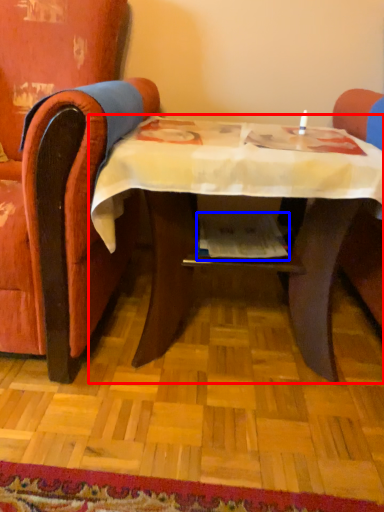
Question: Which of the following is the closest to the observer, table (highlighted by a red box) or magazine (highlighted by a blue box)?

Choices:
 (A) table
 (B) magazine

Answer: (A)